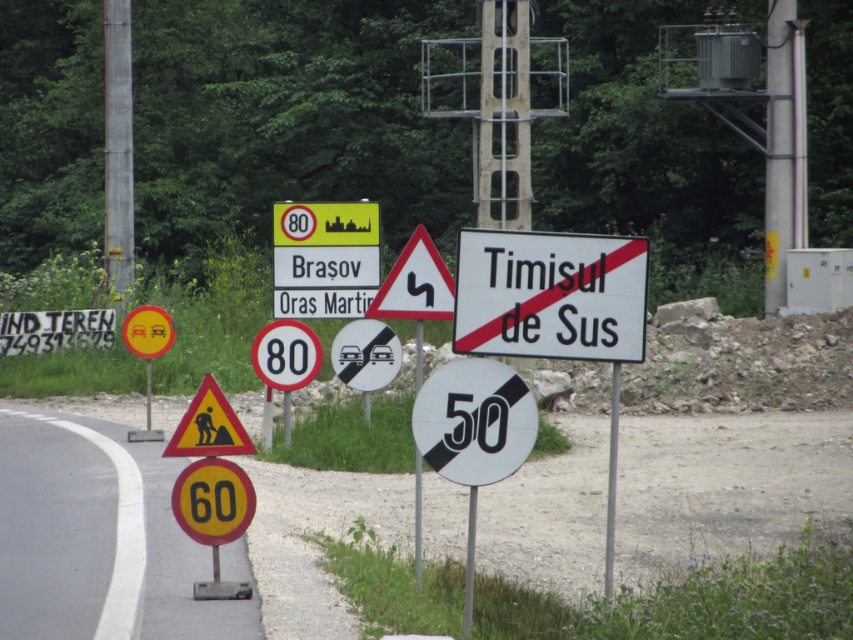
Question: Is white paper sign at center wider than white/black circular sign at center?

Choices:
 (A) yes
 (B) no

Answer: (A)

Question: Among these points, which one is farthest from the camera?

Choices:
 (A) (354, 371)
 (B) (608, 560)
 (C) (219, 524)

Answer: (A)

Question: Is white paper sign at center smaller than black plastic speed limit sign at center?

Choices:
 (A) no
 (B) yes

Answer: (A)

Question: Which point is closer to the camera?

Choices:
 (A) (432, 392)
 (B) (196, 404)
 (C) (608, 512)

Answer: (A)

Question: Which object appears farthest from the camera in this image?

Choices:
 (A) white/black circular sign at center
 (B) brushed metal pole at center
 (C) yellow matte speed limit sign at lower left

Answer: (C)

Question: Considering the relative positions of yellowmaterial/textureconstruction worker at center and white plastic sign at center in the image provided, where is yellowmaterial/textureconstruction worker at center located with respect to white plastic sign at center?

Choices:
 (A) above
 (B) below

Answer: (A)